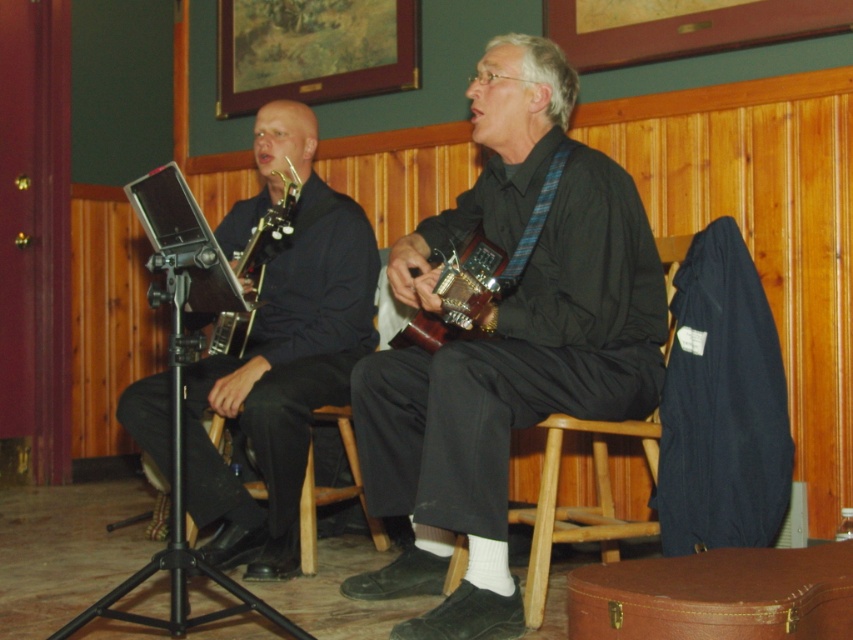
Consider the image. Who is more forward, (x=305, y=257) or (x=436, y=340)?

Point (x=436, y=340) is in front.

Find the location of `matte black saxophone at center`. matte black saxophone at center is located at coordinates (281, 352).

Is wooden acoustic guitar at center further to camera compared to metallic gold guitar at center?

No, wooden acoustic guitar at center is closer to the viewer.

Which is more to the left, wooden acoustic guitar at center or metallic gold guitar at center?

From the viewer's perspective, metallic gold guitar at center appears more on the left side.

Between point (431, 340) and point (239, 342), which one is positioned in front?

Point (431, 340) is more forward.

The width and height of the screenshot is (853, 640). I want to click on wooden acoustic guitar at center, so click(457, 292).

Which of these two, wooden at center or wooden acoustic guitar at center, stands taller?

wooden at center is taller.

Does wooden at center appear on the left side of wooden acoustic guitar at center?

Incorrect, wooden at center is not on the left side of wooden acoustic guitar at center.

Does point (601, 445) come closer to viewer compared to point (434, 337)?

No, it is not.

Find the location of a particular element. The image size is (853, 640). wooden at center is located at coordinates (579, 506).